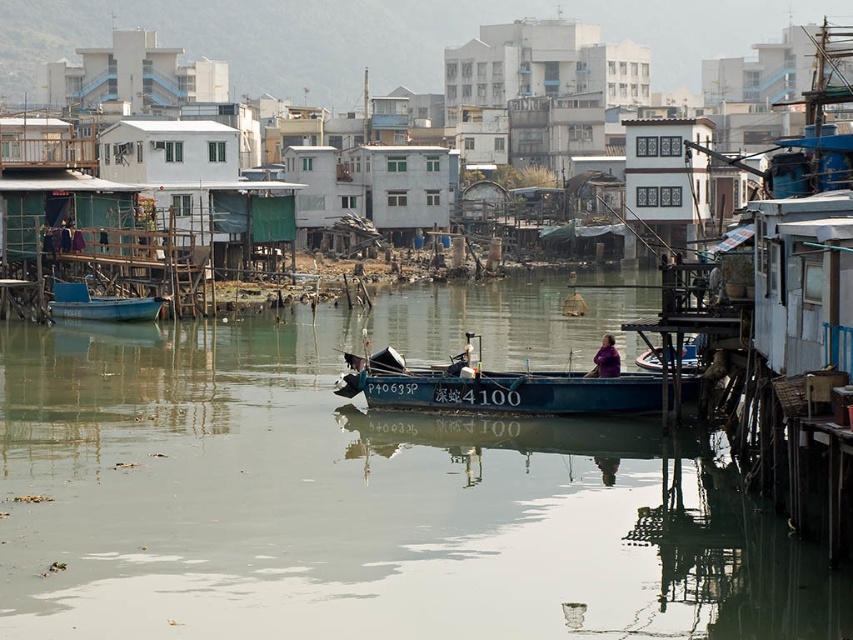
You are a photographer trying to capture the blue matte boat at center and the purple fabric at center in the same frame. Which object should you zoom in on to ensure both are visible without moving the camera?

The blue matte boat at center is thinner than the purple fabric at center, so you should zoom in on the purple fabric at center to ensure both are visible without moving the camera.

You are a delivery drone carrying a package that requires a landing zone at least 2 meters wide. You need to land between the blue matte boat at center and the purple fabric at center. Is the space between them wide enough for your landing?

The distance between the blue matte boat at center and the purple fabric at center is 2.38 meters, which is wider than the required 2 meters. Therefore, the space is sufficient for the drone to land safely.